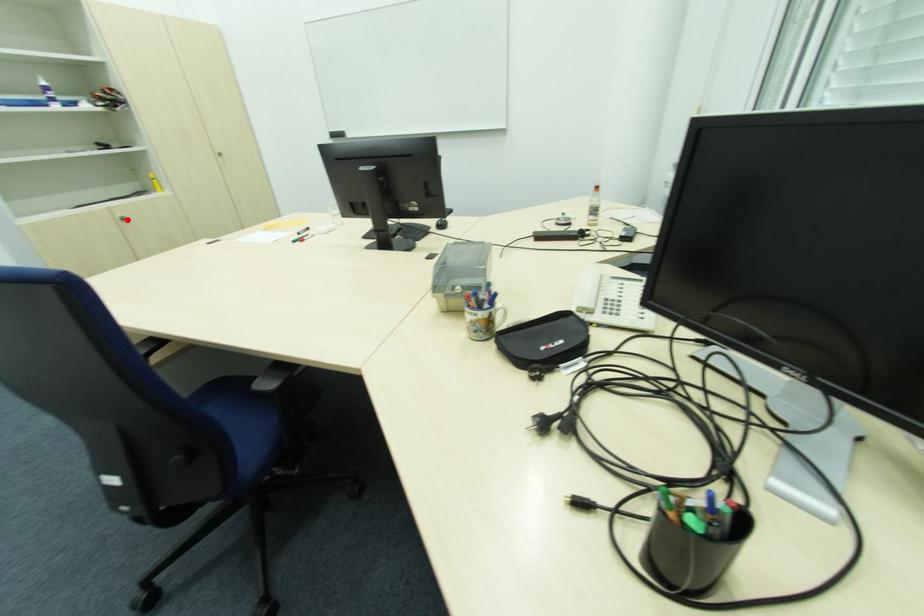
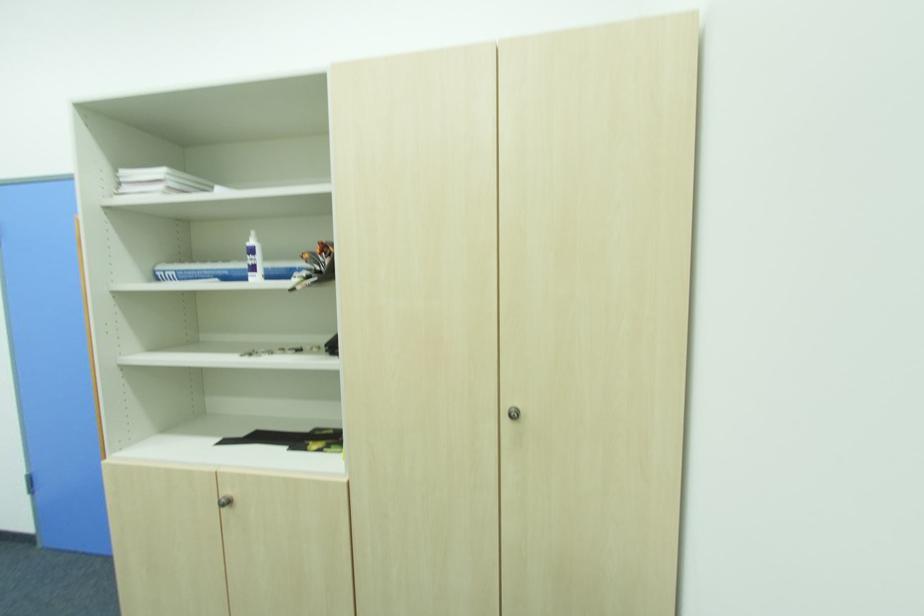
Locate, in the second image, the point that corresponds to the highlighted location in the first image.

(229, 504)